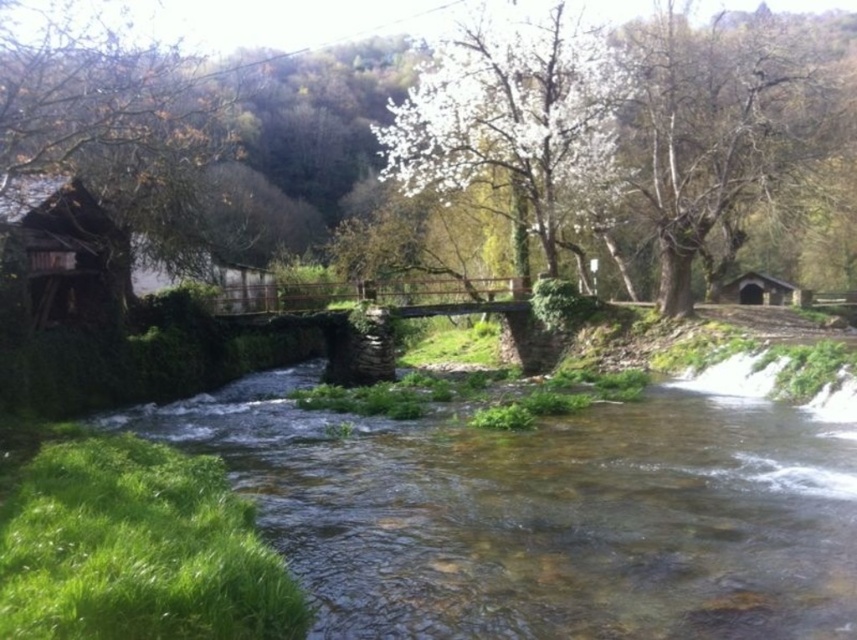
You are a hiker who needs to cross the river using the wooden bridge. There is a brown rough tree at upper right and a green leafy tree at center in your view. Which tree is closer to the wooden bridge?

The green leafy tree at center is closer to the wooden bridge because the brown rough tree at upper right is 4.37 meters away from it, implying the green leafy tree is nearer to the bridge than the brown rough tree.

You are standing at the point marked by the coordinate point at (714, 124) in the image. What object are you currently standing on?

You are standing on the brown rough tree at upper right, as the point at (714, 124) is located on it.

You are planning to cross the river using the wooden bridge in the scene. However, you notice the clear water at center and the brown rough tree at upper right. Which of these two objects is larger in size?

The brown rough tree at upper right is larger in size compared to the clear water at center.